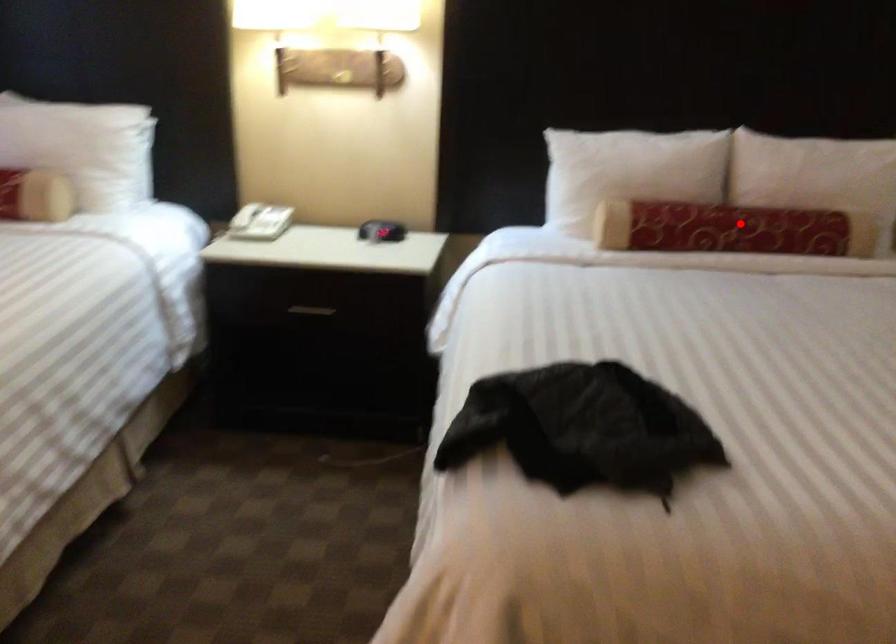
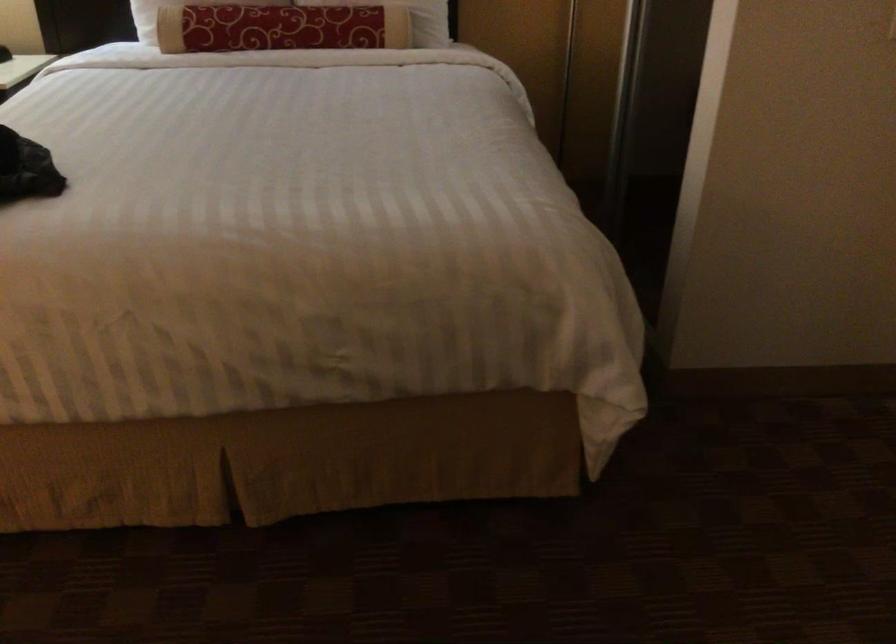
Question: I am providing you with two images of the same scene from different viewpoints. A red point is marked on the first image. At the location where the point appears in image 1, is it still visible in image 2?

Choices:
 (A) Yes
 (B) No

Answer: (A)